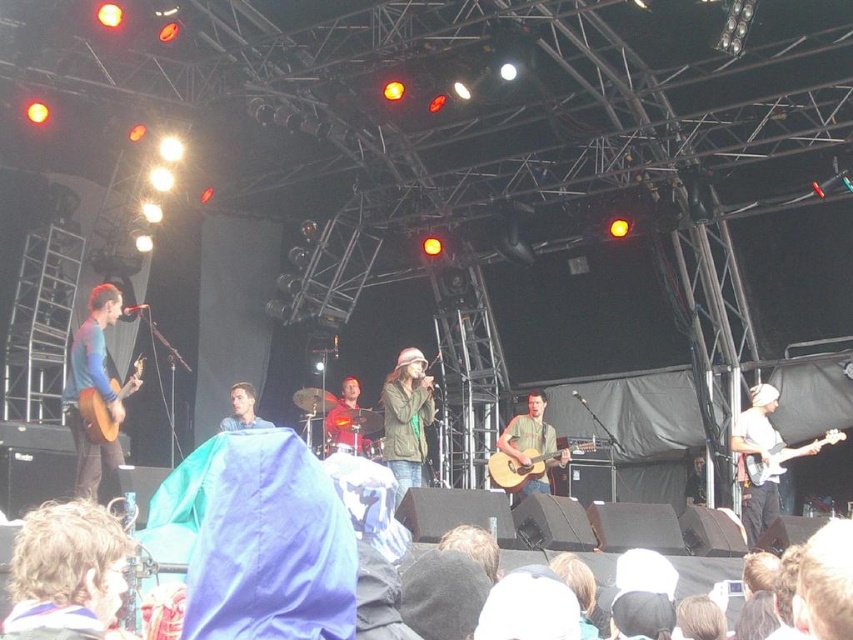
You are a photographer at the concert venue. You need to place a spotlight at point (405, 419). The spotlight has a beam width of 0.2. What object will be illuminated by the spotlight?

The point (405, 419) is on the green matte jacket at center. The spotlight with a beam width of 0.2 will illuminate the green matte jacket at center.

You are a photographer standing at the back of the venue. You want to take a photo that includes both the green matte jacket at center and the drummer behind the singer. How far apart are these two subjects in meters?

The green matte jacket at center and the drummer behind the singer are 12.12 meters apart.

You are a photographer at the concert and want to capture a wide shot of the stage. The acoustic wood guitar at left and the blue fabric at center are both in your frame. Which object appears narrower in the photo?

The acoustic wood guitar at left has a lesser width compared to the blue fabric at center, so it appears narrower in the photo.